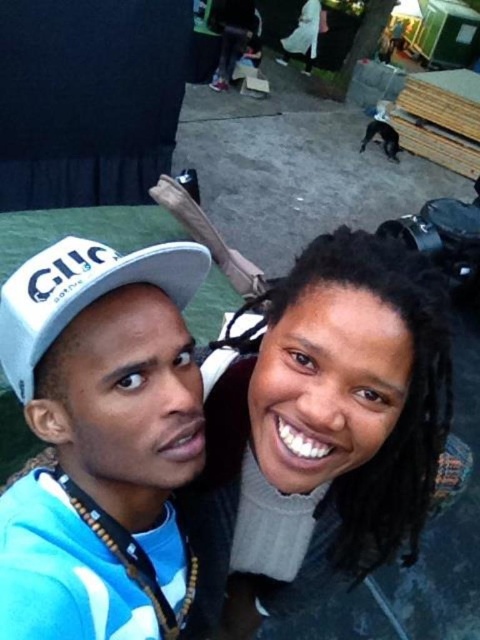
Question: Considering the real-world distances, which object is farthest from the white matte baseball cap at upper left?

Choices:
 (A) smooth gray sweater at center
 (B) white matte cap at upper left

Answer: (A)

Question: Which of these objects is positioned farthest from the white matte cap at upper left?

Choices:
 (A) white matte baseball cap at upper left
 (B) smooth gray sweater at center

Answer: (B)

Question: Can you confirm if white matte cap at upper left is wider than white matte baseball cap at upper left?

Choices:
 (A) no
 (B) yes

Answer: (B)

Question: Which of the following is the farthest from the observer?

Choices:
 (A) white matte baseball cap at upper left
 (B) smooth gray sweater at center

Answer: (B)

Question: Does white matte cap at upper left appear on the right side of white matte baseball cap at upper left?

Choices:
 (A) no
 (B) yes

Answer: (A)

Question: Considering the relative positions of white matte cap at upper left and white matte baseball cap at upper left in the image provided, where is white matte cap at upper left located with respect to white matte baseball cap at upper left?

Choices:
 (A) below
 (B) above

Answer: (A)